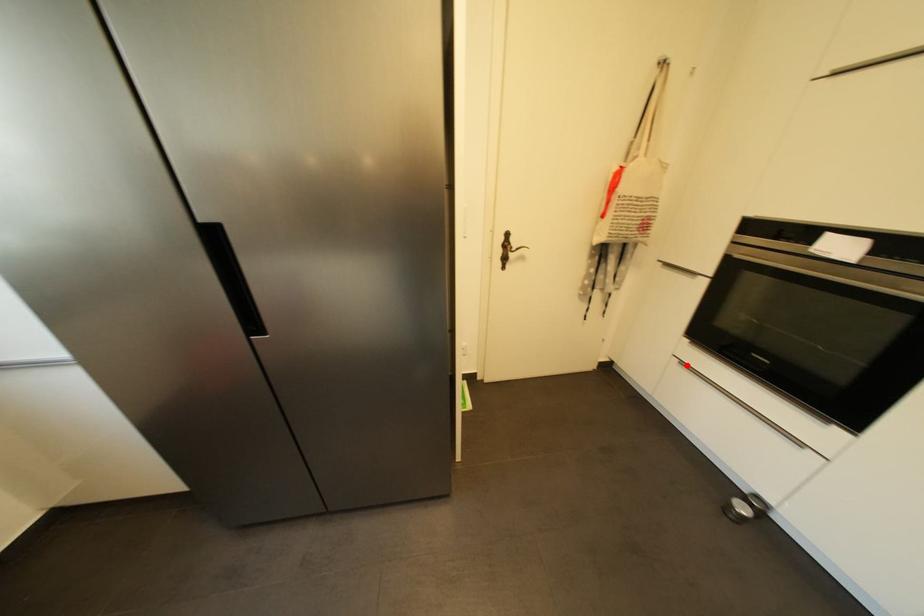
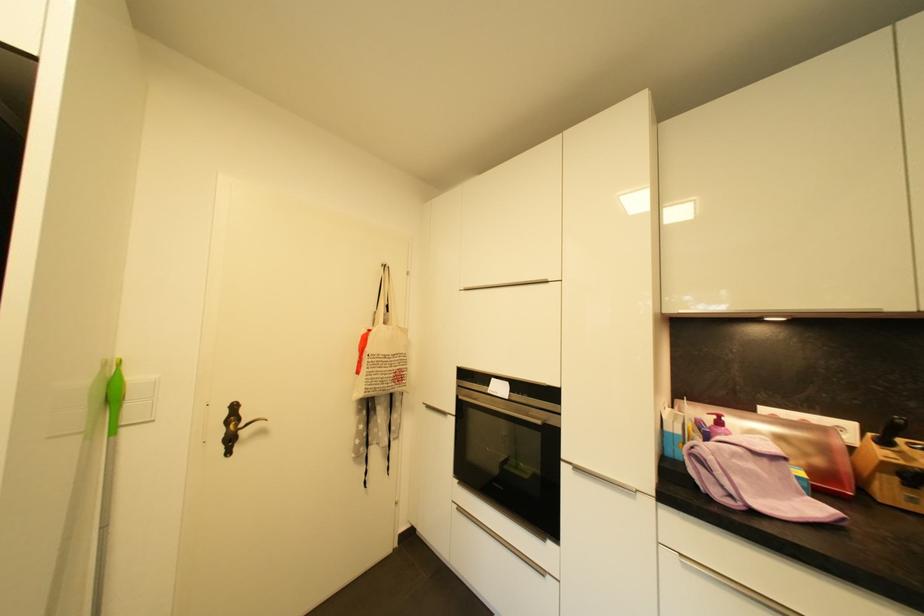
Question: I am providing you with two images of the same scene from different viewpoints. A red point is shown in image1. For the corresponding object point in image2, is it positioned nearer or farther from the camera?

Choices:
 (A) Nearer
 (B) Farther

Answer: (B)